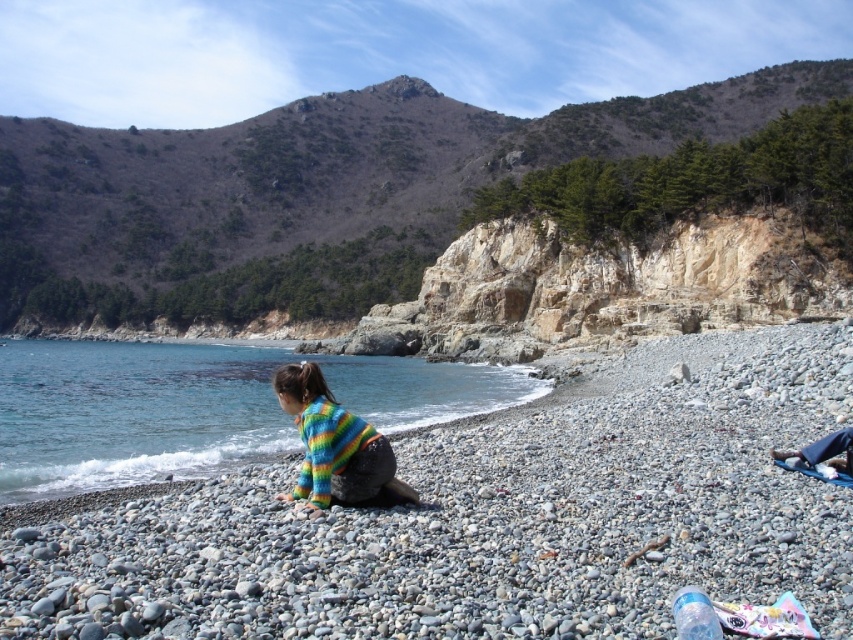
Question: Which of the following is the farthest from the observer?

Choices:
 (A) blue fabric pants at lower right
 (B) blue water at lower left
 (C) multicolored knitted sweater at center

Answer: (B)

Question: Among these objects, which one is farthest from the camera?

Choices:
 (A) smooth pebbles at center
 (B) blue fabric pants at lower right
 (C) multicolored knitted sweater at center

Answer: (B)

Question: Is smooth pebbles at center below blue fabric pants at lower right?

Choices:
 (A) yes
 (B) no

Answer: (A)

Question: Is smooth pebbles at center to the right of blue water at lower left from the viewer's perspective?

Choices:
 (A) no
 (B) yes

Answer: (B)

Question: In this image, where is smooth pebbles at center located relative to multicolored knitted sweater at center?

Choices:
 (A) left
 (B) right

Answer: (B)

Question: Which object appears closest to the camera in this image?

Choices:
 (A) blue water at lower left
 (B) blue fabric pants at lower right
 (C) rocky cliff at upper center

Answer: (B)